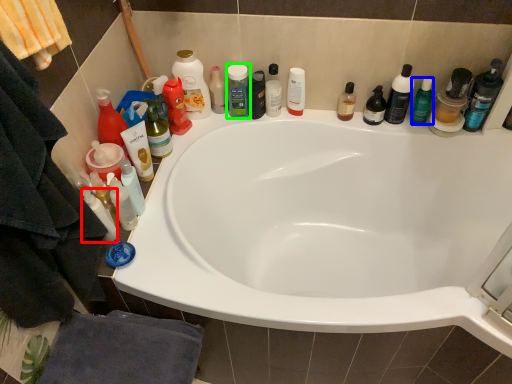
Question: Which object is the closest to the toiletry (highlighted by a red box)? Choose among these: toiletry (highlighted by a blue box) or toiletry (highlighted by a green box).

Choices:
 (A) toiletry
 (B) toiletry

Answer: (B)